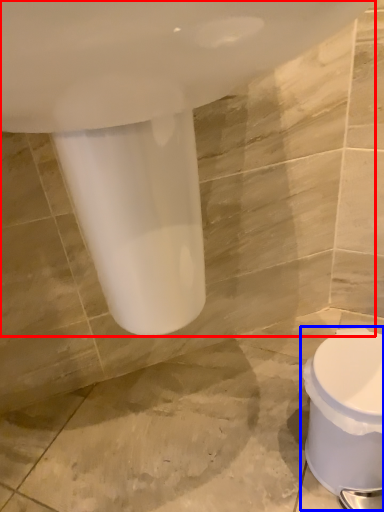
Question: Which of the following is the farthest to the observer, bath (highlighted by a red box) or toilet (highlighted by a blue box)?

Choices:
 (A) bath
 (B) toilet

Answer: (B)